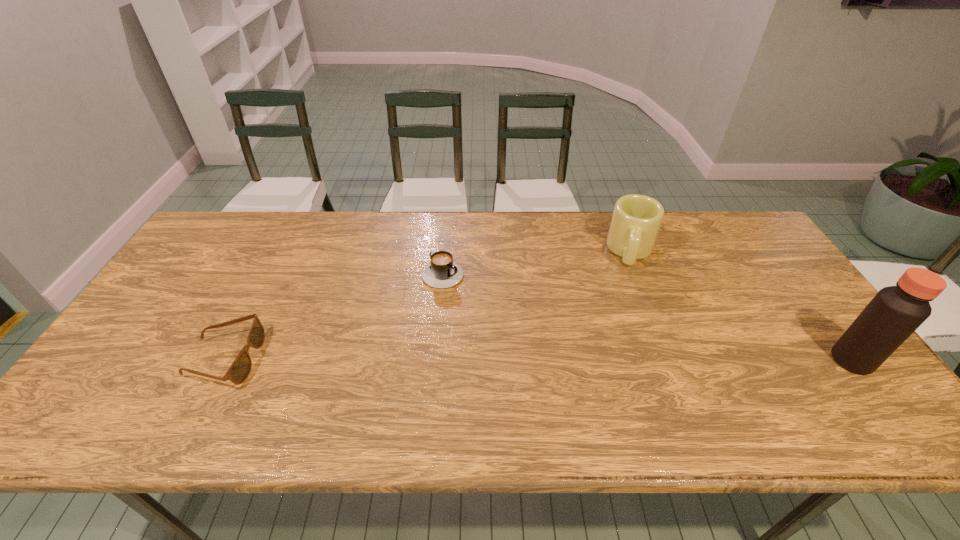
You are a GUI agent. You are given a task and a screenshot of the screen. Output one action in this format:
    pyautogui.click(x=<x>, y=<y>)
    Task: Click on the leftmost object
    This screenshot has height=540, width=960.
    Given the screenshot: What is the action you would take?
    pyautogui.click(x=238, y=372)

I want to click on the rightmost object, so click(x=895, y=312).

Find the location of a particular element. the tallest object is located at coordinates (895, 312).

Find the location of a particular element. The height and width of the screenshot is (540, 960). mug is located at coordinates (636, 220).

Find the location of a particular element. the second tallest object is located at coordinates (636, 220).

Where is `the third object from right to left`? the third object from right to left is located at coordinates (442, 272).

This screenshot has height=540, width=960. What are the coordinates of `vacant region located on the frames of the sunglasses` in the screenshot? It's located at (314, 359).

The height and width of the screenshot is (540, 960). What are the coordinates of `free spot located on the left of the vinegar` in the screenshot? It's located at (670, 360).

Locate an element on the screen. vacant point located with the handle on the side of the second tallest object is located at coordinates (629, 307).

Find the location of a particular element. The width and height of the screenshot is (960, 540). free space located with the handle on the side of the second tallest object is located at coordinates pyautogui.click(x=631, y=292).